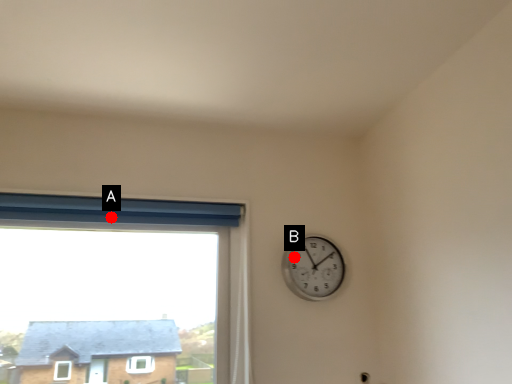
Question: Two points are circled on the image, labeled by A and B beside each circle. Which of the following is the closest to the observer?

Choices:
 (A) A is closer
 (B) B is closer

Answer: (A)